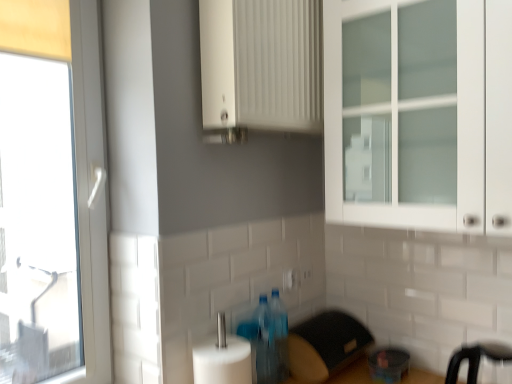
Question: Does translucent plastic bottles at lower center, the 1th bottle from the front, have a lesser width compared to black plastic bar stool at lower right?

Choices:
 (A) no
 (B) yes

Answer: (B)

Question: From a real-world perspective, is translucent plastic bottles at lower center, the 1th bottle from the front, under black plastic bar stool at lower right?

Choices:
 (A) yes
 (B) no

Answer: (B)

Question: Is translucent plastic bottles at lower center, positioned as the 2th bottle in back-to-front order, not within black plastic bar stool at lower right?

Choices:
 (A) no
 (B) yes

Answer: (B)

Question: From the image's perspective, is translucent plastic bottles at lower center, positioned as the 2th bottle in back-to-front order, above black plastic bar stool at lower right?

Choices:
 (A) no
 (B) yes

Answer: (B)

Question: From the image's perspective, does translucent plastic bottles at lower center, positioned as the 2th bottle in back-to-front order, appear lower than black plastic bar stool at lower right?

Choices:
 (A) yes
 (B) no

Answer: (B)

Question: Is transparent glass window at left taller or shorter than translucent plastic bottles at lower center, the 1th bottle from the front?

Choices:
 (A) tall
 (B) short

Answer: (A)

Question: From the image's perspective, is transparent glass window at left located above or below translucent plastic bottles at lower center, the 1th bottle from the front?

Choices:
 (A) above
 (B) below

Answer: (A)

Question: Is transparent glass window at left in front of or behind translucent plastic bottles at lower center, positioned as the 2th bottle in back-to-front order, in the image?

Choices:
 (A) behind
 (B) front

Answer: (B)

Question: Do you think transparent glass window at left is within translucent plastic bottles at lower center, positioned as the 2th bottle in back-to-front order, or outside of it?

Choices:
 (A) outside
 (B) inside

Answer: (A)

Question: In terms of height, does black plastic toaster at lower center, acting as the first appliance starting from the left, look taller or shorter compared to white plastic electric outlet at center, marked as the 1th electric outlet in a right-to-left arrangement?

Choices:
 (A) short
 (B) tall

Answer: (B)

Question: Is point (296, 339) positioned closer to the camera than point (307, 274)?

Choices:
 (A) closer
 (B) farther

Answer: (A)

Question: Is black plastic toaster at lower center, the 2th appliance from the right, wider or thinner than white plastic electric outlet at center, the second electric outlet viewed from the front?

Choices:
 (A) wide
 (B) thin

Answer: (A)

Question: From the image's perspective, relative to white plastic electric outlet at center, marked as the 1th electric outlet in a right-to-left arrangement, is black plastic toaster at lower center, acting as the first appliance starting from the left, above or below?

Choices:
 (A) below
 (B) above

Answer: (A)

Question: Considering their positions, is white glass cabinet at upper right located in front of or behind white plastic electric outlet at center, the 2th electric outlet in the back-to-front sequence?

Choices:
 (A) behind
 (B) front

Answer: (B)

Question: From a real-world perspective, is white glass cabinet at upper right physically located above or below white plastic electric outlet at center, which is counted as the 2th electric outlet, starting from the right?

Choices:
 (A) below
 (B) above

Answer: (B)